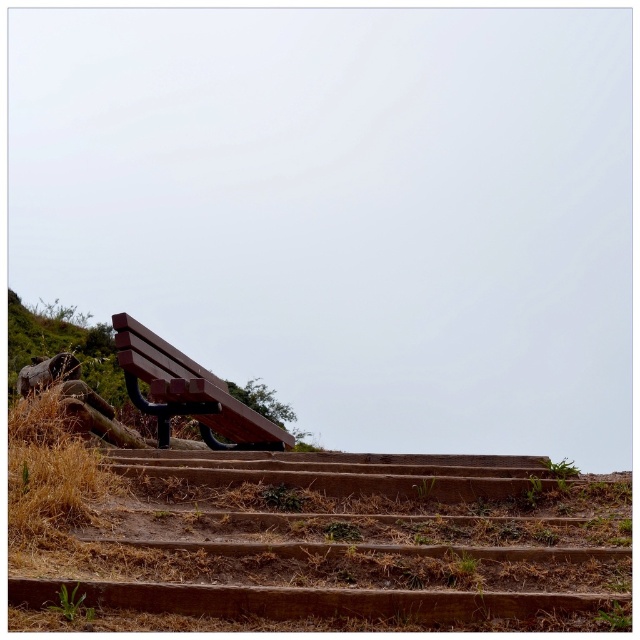
You are standing at the bottom of the brown wooden stairs at lower center and want to reach the bench at the top. What direction should you move in to climb the stairs?

Since the brown wooden stairs at lower center are located at point (342, 540) in the image, you should move upwards towards the bench to climb the stairs.

Consider the image. You are carrying a large painting that is 1.2 meters wide. You need to move it from the bottom of the brown wooden stairs at lower center to the wooden bench at center. Can you carry the painting upright through the stairs?

The brown wooden stairs at lower center might be wider than the wooden bench at center. However, since the exact width of the stairs is not specified, it is uncertain whether the painting will fit. You should check the actual width of the stairs before attempting to move the painting upright.

You are a painter who needs to set up an easel. You have two options for placement in the scene described. The first option is near the brown wooden stairs at lower center, and the second is near the wooden bench at center. Considering their heights, which location would allow your easel to be more visible to someone approaching from below?

The wooden bench at center is taller than the brown wooden stairs at lower center, so placing the easel near the wooden bench at center would make it more visible to someone approaching from below.